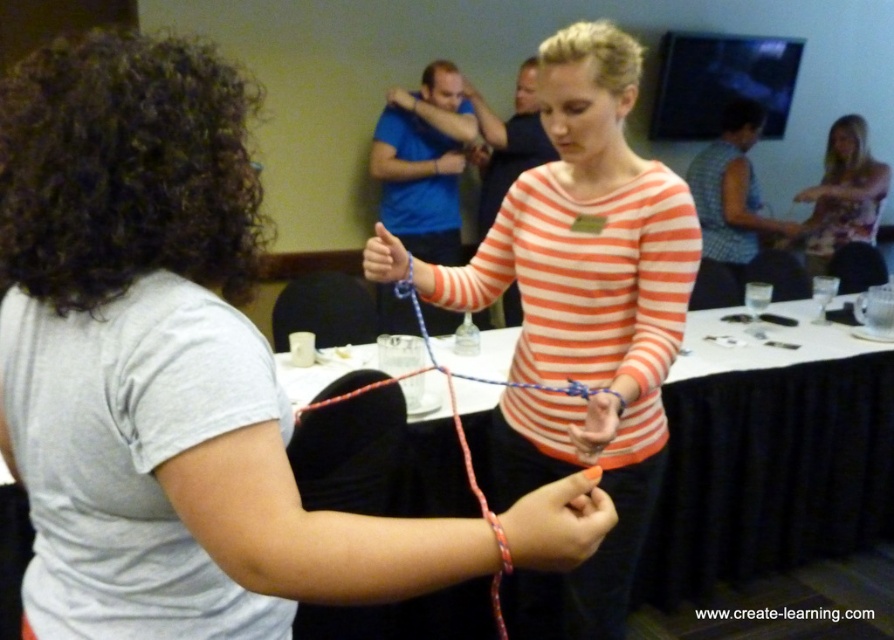
Question: Is orange striped shirt at center smaller than matte plastic table at center?

Choices:
 (A) no
 (B) yes

Answer: (B)

Question: Does matte orange striped shirt at center appear over floral fabric shirt at upper right?

Choices:
 (A) no
 (B) yes

Answer: (A)

Question: Which of these objects is positioned closest to the matte orange striped shirt at center?

Choices:
 (A) matte plastic table at center
 (B) floral fabric shirt at upper right

Answer: (A)

Question: Among these objects, which one is nearest to the camera?

Choices:
 (A) matte plastic table at center
 (B) orange striped shirt at center

Answer: (B)

Question: Considering the relative positions of orange striped shirt at center and matte plastic table at center in the image provided, where is orange striped shirt at center located with respect to matte plastic table at center?

Choices:
 (A) right
 (B) left

Answer: (B)

Question: Which point appears farthest from the camera in this image?

Choices:
 (A) (856, 218)
 (B) (184, 100)
 (C) (660, 508)

Answer: (A)